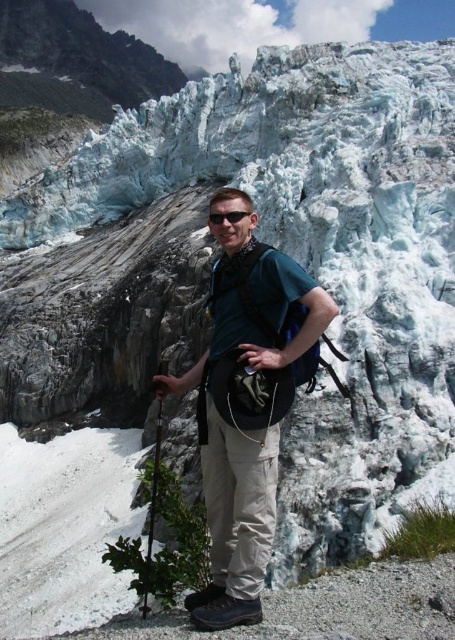
Question: Can you confirm if green fabric backpack at center is bigger than sunglasses at center?

Choices:
 (A) yes
 (B) no

Answer: (A)

Question: Does green fabric backpack at center come in front of sunglasses at center?

Choices:
 (A) no
 (B) yes

Answer: (B)

Question: Which of the following is the farthest from the observer?

Choices:
 (A) (247, 410)
 (B) (234, 218)

Answer: (B)

Question: Does green fabric backpack at center lie in front of sunglasses at center?

Choices:
 (A) no
 (B) yes

Answer: (B)